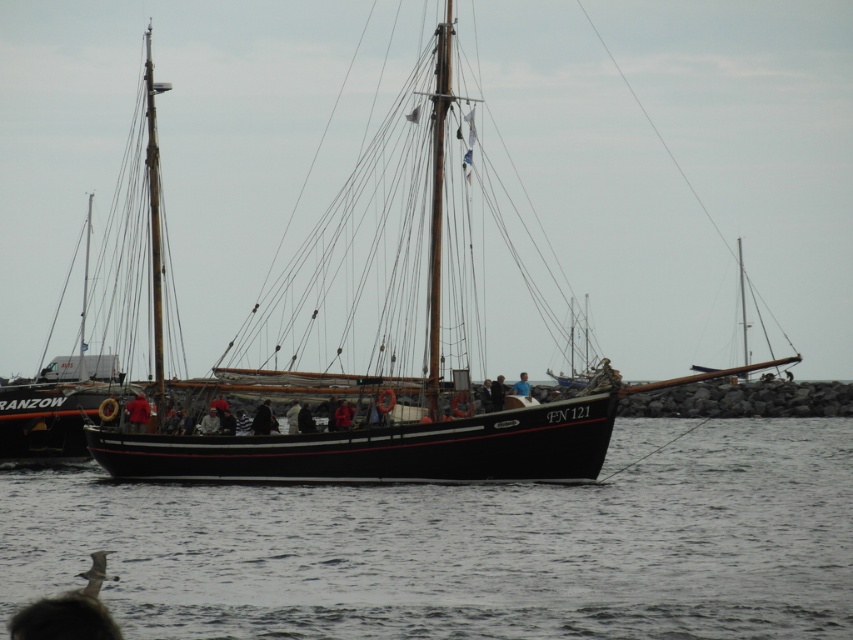
You are a sailor on the deck of the black polished wood sailboat at center. You need to secure the blue fabric at center to the mast. Considering the height difference between the two, what challenge might you face?

The black polished wood sailboat at center is much taller than the blue fabric at center, so you may struggle to reach the top of the sailboat to secure the blue fabric at center properly.